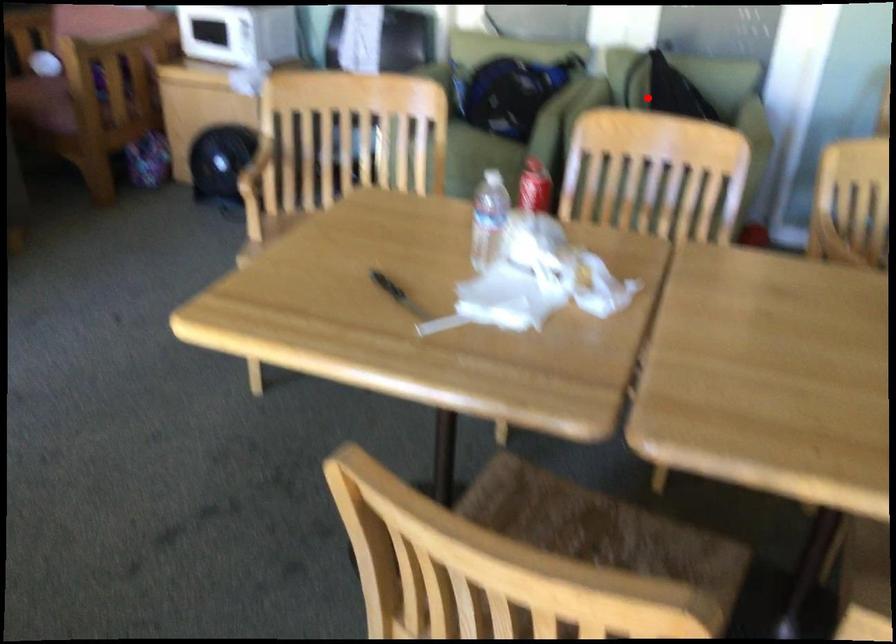
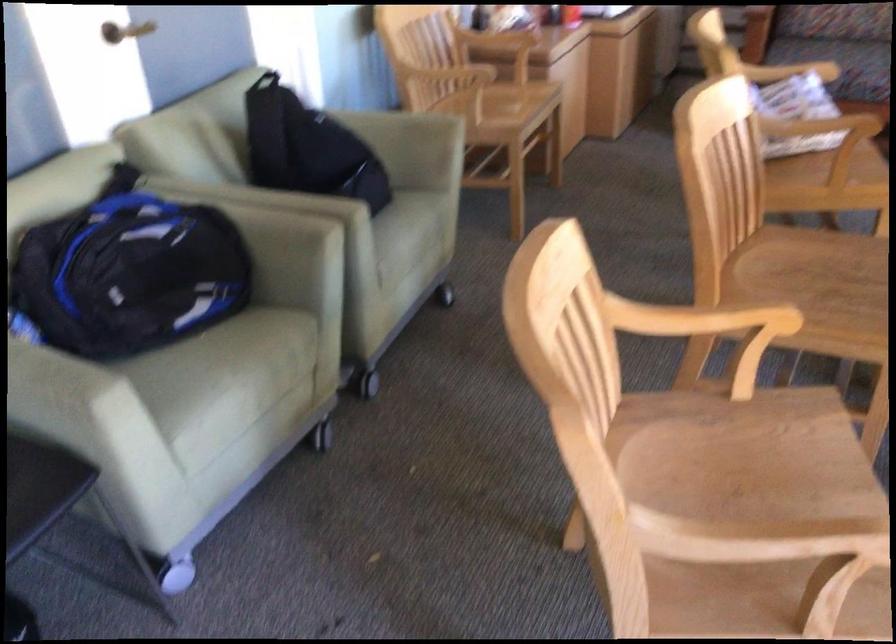
Question: I am providing you with two images of the same scene from different viewpoints. A red point is shown in image1. For the corresponding object point in image2, is it positioned nearer or farther from the camera?

Choices:
 (A) Nearer
 (B) Farther

Answer: (A)